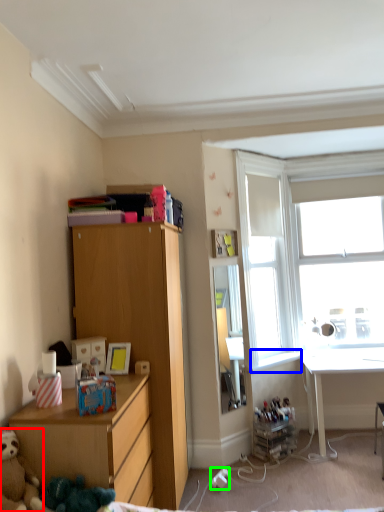
Question: Which object is positioned closest to teddy bear (highlighted by a red box)? Select from window sill (highlighted by a blue box) and power outlet (highlighted by a green box).

Choices:
 (A) window sill
 (B) power outlet

Answer: (B)